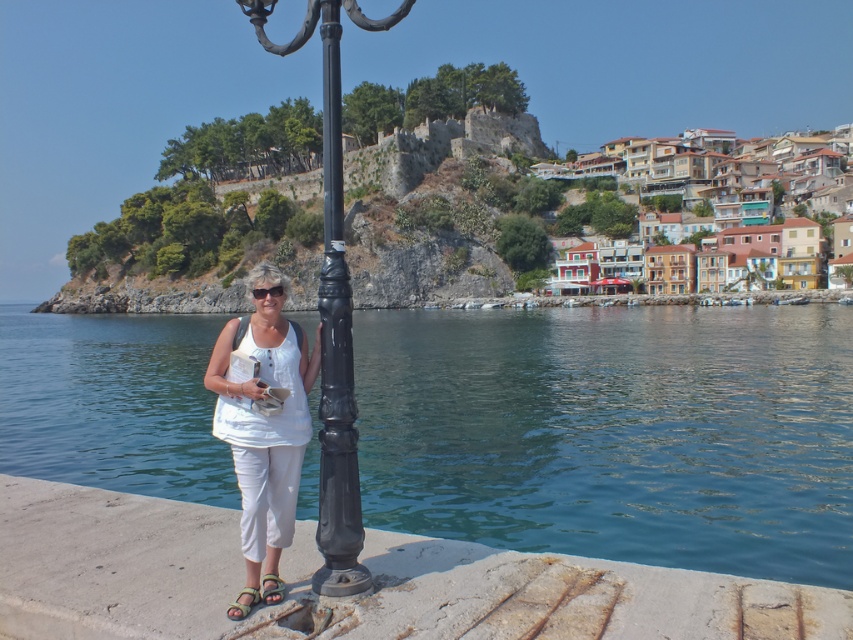
Who is more forward, (334, 42) or (244, 589)?

Point (334, 42) is in front.

Find the location of a particular element. This screenshot has height=640, width=853. black metal lamp post at center is located at coordinates (332, 308).

The height and width of the screenshot is (640, 853). Identify the location of black metal lamp post at center. (332, 308).

Which is below, concrete at lower left or black metal lamp post at center?

concrete at lower left is lower down.

Does concrete at lower left come in front of black metal lamp post at center?

Yes.

Describe the element at coordinates (352, 595) in the screenshot. The image size is (853, 640). I see `concrete at lower left` at that location.

This screenshot has height=640, width=853. I want to click on concrete at lower left, so click(x=352, y=595).

Who is more forward, (328, 580) or (322, 305)?

Point (328, 580) is more forward.

Who is more distant from viewer, (347, 305) or (321, 368)?

The point (321, 368) is more distant.

In order to click on black metal lamp post at center in this screenshot , I will do `click(332, 308)`.

I want to click on black metal lamp post at center, so click(332, 308).